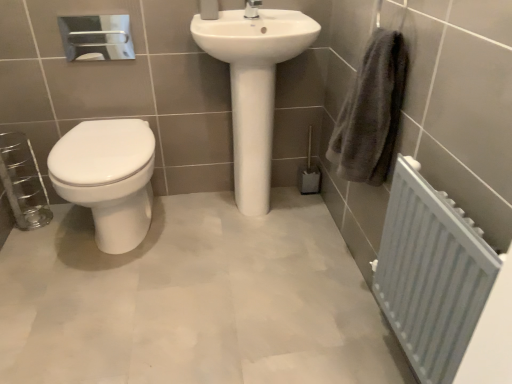
I want to click on vacant space to the right of polished chrome tap at upper center, so click(282, 15).